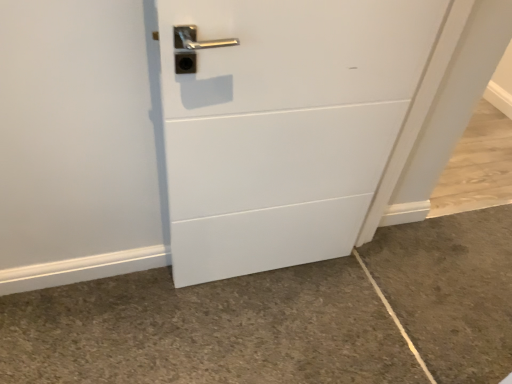
Find the location of a particular element. The image size is (512, 384). white matte door at center is located at coordinates (284, 125).

Describe the element at coordinates (284, 125) in the screenshot. I see `white matte door at center` at that location.

Identify the location of white matte door at center. (284, 125).